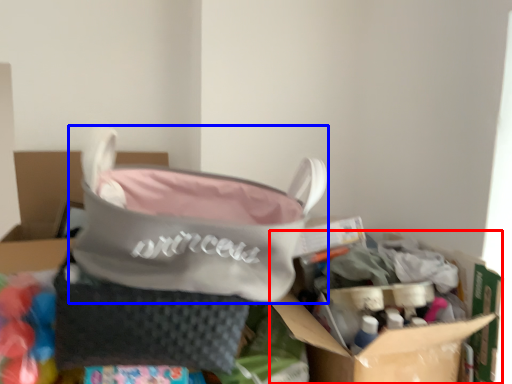
Question: Which object is further to the camera taking this photo, cardboard box (highlighted by a red box) or handbag (highlighted by a blue box)?

Choices:
 (A) cardboard box
 (B) handbag

Answer: (A)